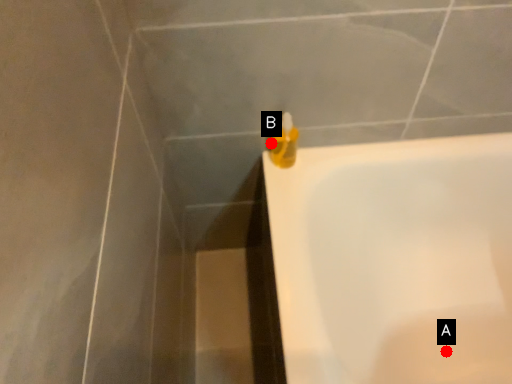
Question: Two points are circled on the image, labeled by A and B beside each circle. Which point is closer to the camera?

Choices:
 (A) A is closer
 (B) B is closer

Answer: (B)